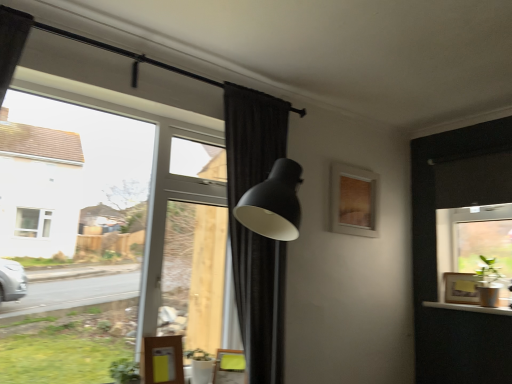
Question: Is green matte plant at lower left at the back of transparent glass window at upper left, which is counted as the 2th window, starting from the right?

Choices:
 (A) no
 (B) yes

Answer: (A)

Question: Is green matte plant at lower left surrounded by transparent glass window at upper left, the 1th window when ordered from left to right?

Choices:
 (A) yes
 (B) no

Answer: (B)

Question: Does transparent glass window at upper left, which is counted as the 2th window, starting from the right, have a lesser width compared to green matte plant at lower left?

Choices:
 (A) no
 (B) yes

Answer: (A)

Question: Is transparent glass window at upper left, which is counted as the 2th window, starting from the right, taller than green matte plant at lower left?

Choices:
 (A) yes
 (B) no

Answer: (A)

Question: Is transparent glass window at upper left, which is counted as the 2th window, starting from the right, with green matte plant at lower left?

Choices:
 (A) no
 (B) yes

Answer: (A)

Question: Visually, is green matte plant at lower left positioned to the left or to the right of green matte plant at right?

Choices:
 (A) left
 (B) right

Answer: (A)

Question: Based on their sizes in the image, would you say green matte plant at lower left is bigger or smaller than green matte plant at right?

Choices:
 (A) big
 (B) small

Answer: (B)

Question: Is green matte plant at lower left in front of or behind green matte plant at right in the image?

Choices:
 (A) front
 (B) behind

Answer: (A)

Question: From the image's perspective, is green matte plant at lower left above or below green matte plant at right?

Choices:
 (A) below
 (B) above

Answer: (A)

Question: From the image's perspective, is green matte plant at right above or below yellow fabric swivel chair at lower center?

Choices:
 (A) below
 (B) above

Answer: (B)

Question: From a real-world perspective, relative to yellow fabric swivel chair at lower center, is green matte plant at right vertically above or below?

Choices:
 (A) above
 (B) below

Answer: (A)

Question: Does point (488, 274) appear closer or farther from the camera than point (230, 360)?

Choices:
 (A) farther
 (B) closer

Answer: (A)

Question: In terms of width, does green matte plant at right look wider or thinner when compared to yellow fabric swivel chair at lower center?

Choices:
 (A) wide
 (B) thin

Answer: (A)

Question: Looking at their shapes, would you say wooden picture frame at right, which is counted as the 2th picture frame, starting from the left, is wider or thinner than yellow wood door at lower left?

Choices:
 (A) thin
 (B) wide

Answer: (B)

Question: From their relative heights in the image, would you say wooden picture frame at right, which appears as the 1th picture frame when ordered from the bottom, is taller or shorter than yellow wood door at lower left?

Choices:
 (A) short
 (B) tall

Answer: (A)